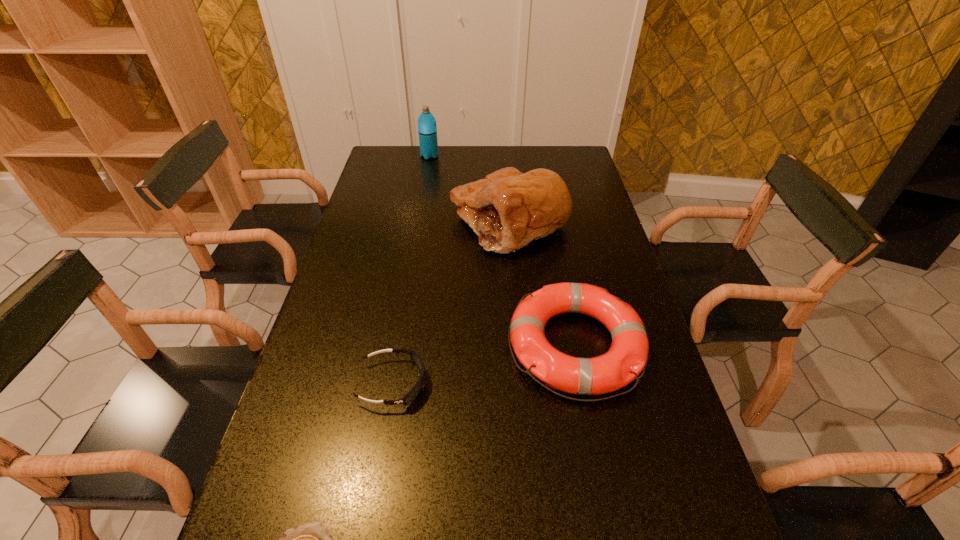
Where is `object that is at the far edge`? object that is at the far edge is located at coordinates (427, 130).

In order to click on object situated at the left edge in this screenshot , I will do `click(416, 358)`.

Locate an element on the screen. bread positioned at the right edge is located at coordinates (508, 209).

Find the location of `life buoy located at the right edge`. life buoy located at the right edge is located at coordinates (628, 355).

What are the coordinates of `vacant space at the far edge of the desktop` in the screenshot? It's located at (528, 170).

This screenshot has height=540, width=960. In the image, there is a desktop. Identify the location of vacant space at the left edge. (347, 280).

In the image, there is a desktop. At what (x,y) coordinates should I click in order to perform the action: click on vacant area at the right edge. Please return your answer as a coordinate pair (x, y). Looking at the image, I should click on (686, 487).

Find the location of `vacant space at the far left corner`. vacant space at the far left corner is located at coordinates (398, 158).

In order to click on empty space that is in between the third shortest object and the bread in this screenshot , I will do `click(542, 284)`.

At what (x,y) coordinates should I click in order to perform the action: click on blank region between the bread and the goggles. Please return your answer as a coordinate pair (x, y). The width and height of the screenshot is (960, 540). Looking at the image, I should click on (451, 303).